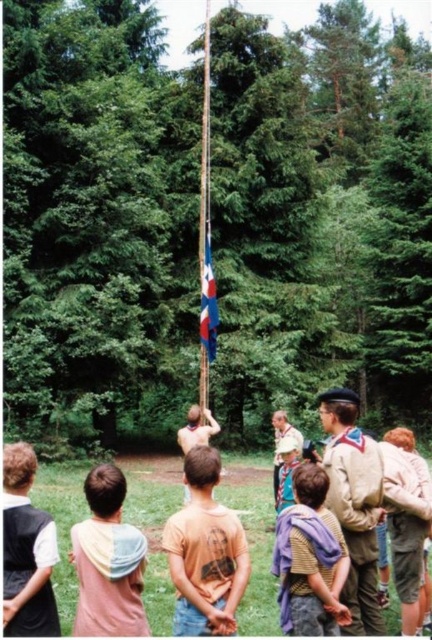
Image resolution: width=432 pixels, height=640 pixels. Find the location of `pastel hoodie at lower left`. pastel hoodie at lower left is located at coordinates (108, 561).

Is pastel hoodie at lower left shorter than white cotton shirt at lower left?

Indeed, pastel hoodie at lower left has a lesser height compared to white cotton shirt at lower left.

Measure the distance between point (127, 531) and camera.

Point (127, 531) and camera are 4.67 meters apart.

Where is `pastel hoodie at lower left`? The width and height of the screenshot is (432, 640). pastel hoodie at lower left is located at coordinates (108, 561).

Does point (40, 593) come in front of point (209, 74)?

Yes, it is.

The height and width of the screenshot is (640, 432). In order to click on white cotton shirt at lower left in this screenshot , I will do `click(26, 550)`.

How distant is white cotton shirt at lower left from blue fabric flag at center?

A distance of 14.49 meters exists between white cotton shirt at lower left and blue fabric flag at center.

Does white cotton shirt at lower left have a greater height compared to blue fabric flag at center?

No.

Locate an element on the screen. This screenshot has width=432, height=640. white cotton shirt at lower left is located at coordinates (26, 550).